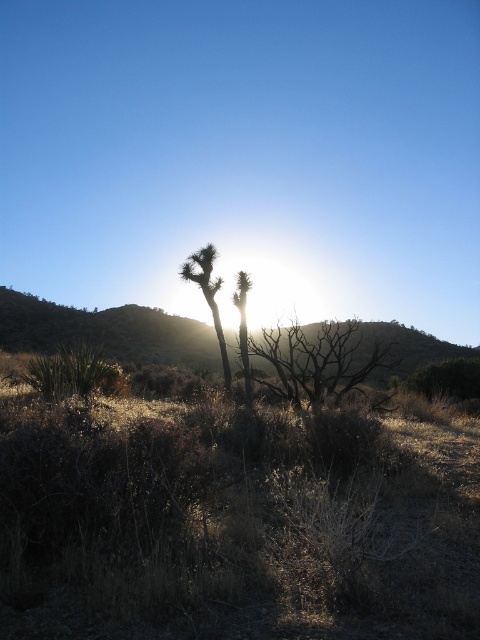
You are a desert explorer who wants to find shade quickly. You see a green leafy tree at center and a green spiky cactus at center. Which one would provide more shade?

The green leafy tree at center is much taller than the green spiky cactus at center, so it would provide more shade.

You are a botanist studying desert flora. You observe a green leafy tree at center and a green spiky cactus at center in the scene. Which of these two plants is bigger?

The green leafy tree at center is larger in size than the green spiky cactus at center.